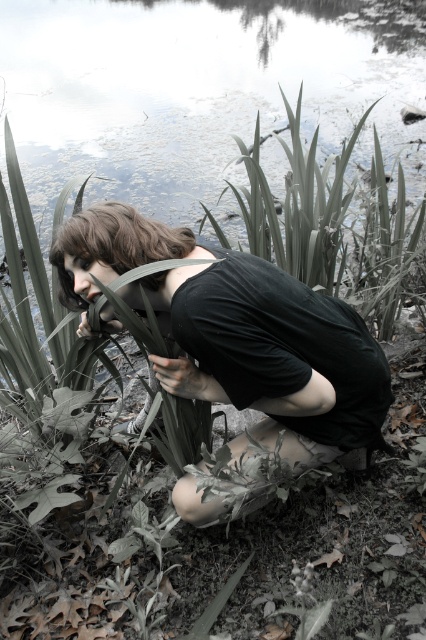
Is black matte shirt at center thinner than dark brown hair at center?

Incorrect, black matte shirt at center's width is not less than dark brown hair at center's.

Which is in front, point (186, 305) or point (72, 291)?

Positioned in front is point (186, 305).

Is point (270, 364) farther from viewer compared to point (75, 248)?

No, (270, 364) is closer to viewer.

You are a GUI agent. You are given a task and a screenshot of the screen. Output one action in this format:
    pyautogui.click(x=<x>, y=<y>)
    Task: Click on the black matte shirt at center
    The height and width of the screenshot is (640, 426).
    Given the screenshot: What is the action you would take?
    pyautogui.click(x=238, y=332)